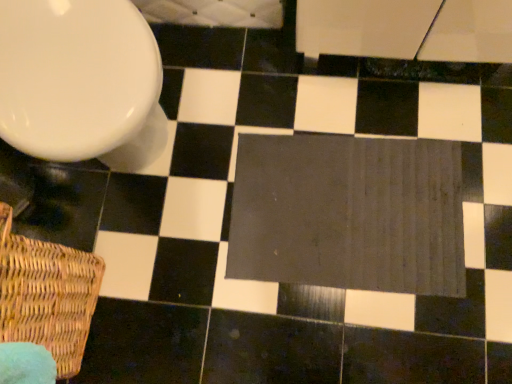
Image resolution: width=512 pixels, height=384 pixels. In order to click on free space on the front side of dark gray fabric bath mat at center in this screenshot , I will do `click(385, 333)`.